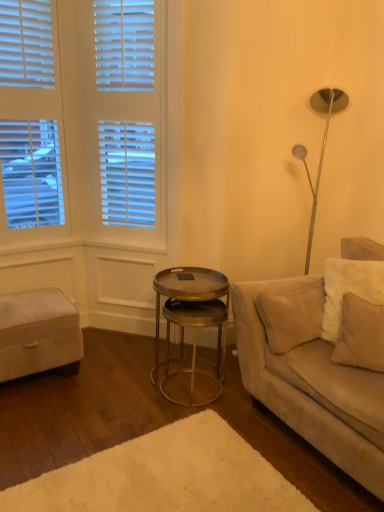
Identify the location of vacant point above metallic gold side table at center (from a real-world perspective). (187, 309).